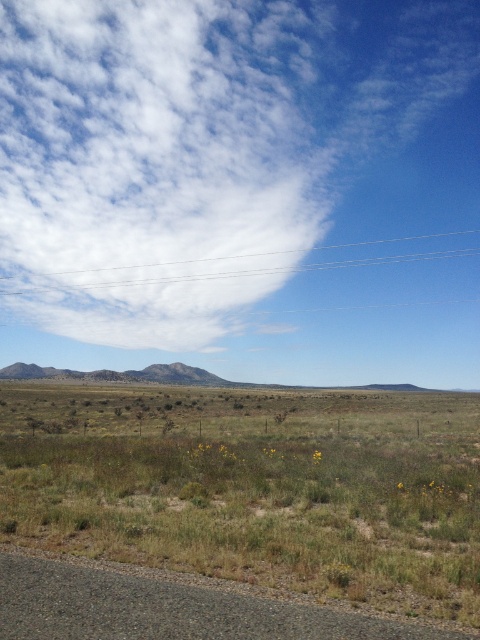
What do you see at coordinates (204, 147) in the screenshot? I see `white fluffy cloud at upper center` at bounding box center [204, 147].

In the scene shown: Is white fluffy cloud at upper center to the left of green grass at lower left from the viewer's perspective?

Correct, you'll find white fluffy cloud at upper center to the left of green grass at lower left.

At what (x,y) coordinates should I click in order to perform the action: click on white fluffy cloud at upper center. Please return your answer as a coordinate pair (x, y). The width and height of the screenshot is (480, 640). Looking at the image, I should click on (204, 147).